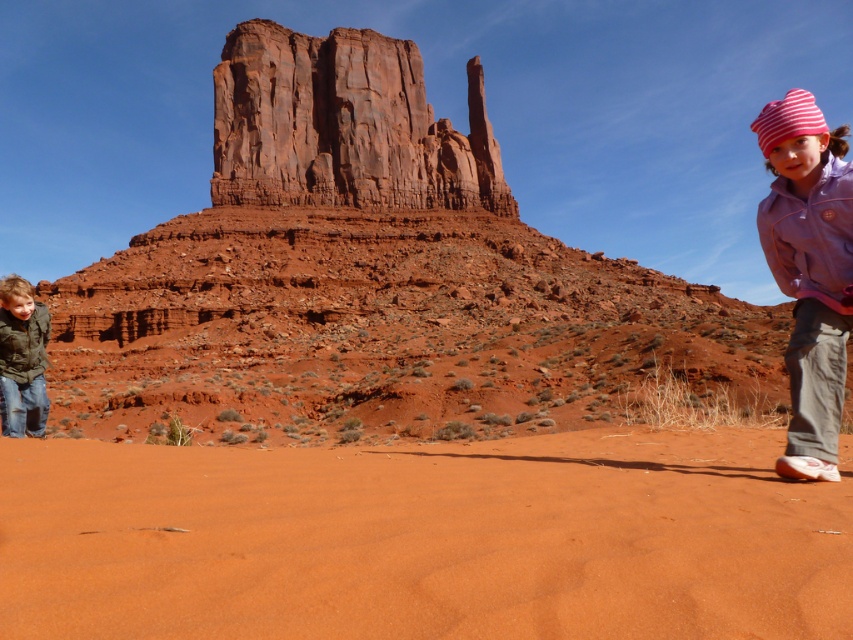
Question: Which object is positioned farthest from the brushed green jacket at lower left?

Choices:
 (A) pink striped knit hat at upper right
 (B) rustic sandstone butte at center

Answer: (B)

Question: Does purple fleece jacket at right lie in front of brushed green jacket at lower left?

Choices:
 (A) yes
 (B) no

Answer: (A)

Question: Considering the relative positions of pink striped knit hat at upper right and brushed green jacket at lower left in the image provided, where is pink striped knit hat at upper right located with respect to brushed green jacket at lower left?

Choices:
 (A) right
 (B) left

Answer: (A)

Question: Based on their relative distances, which object is nearer to the brushed green jacket at lower left?

Choices:
 (A) smooth sand dune at center
 (B) pink striped knit hat at upper right
 (C) purple fleece jacket at right

Answer: (B)

Question: Does smooth sand dune at center have a larger size compared to rustic sandstone butte at center?

Choices:
 (A) no
 (B) yes

Answer: (B)

Question: Among these points, which one is nearest to the camera?

Choices:
 (A) (827, 460)
 (B) (343, 396)
 (C) (426, 586)
 (D) (33, 332)

Answer: (C)